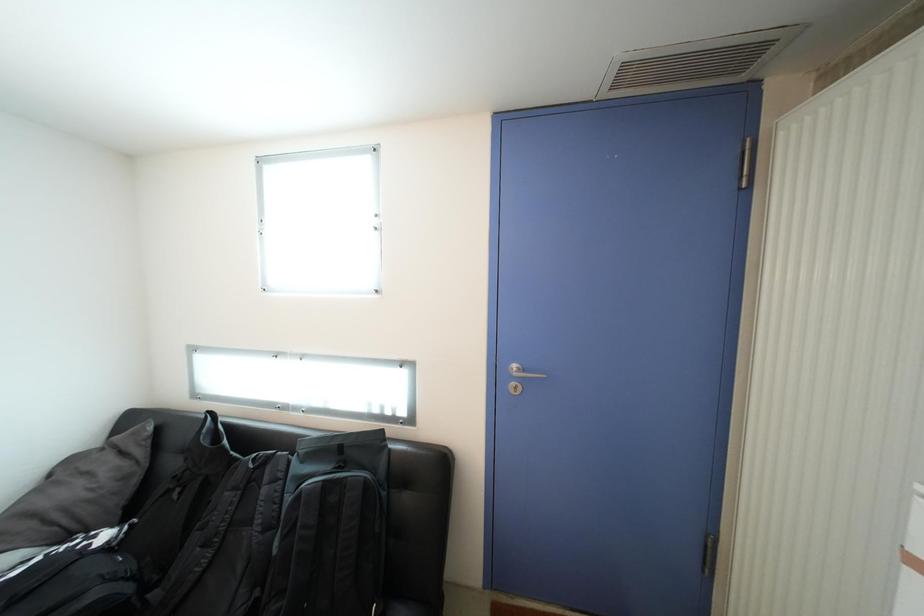
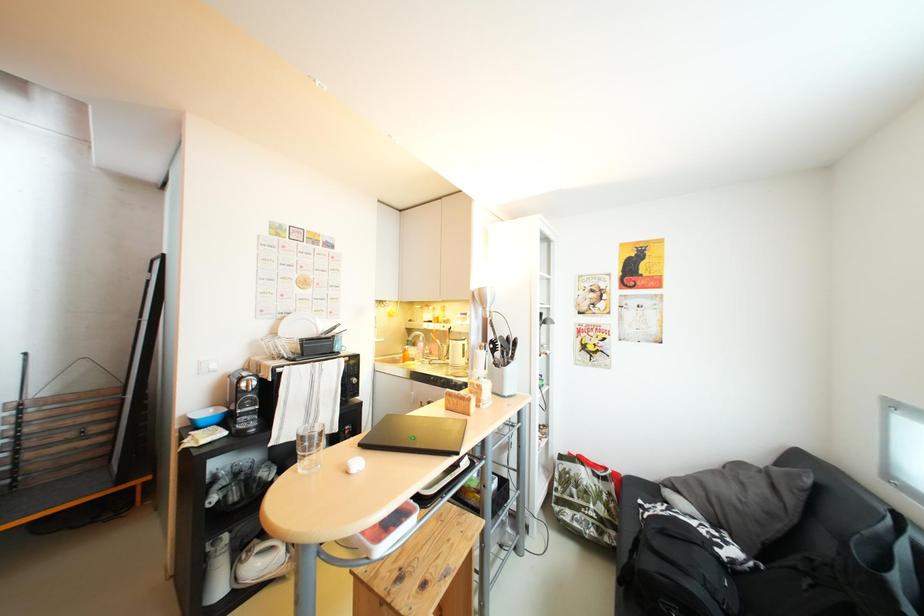
Question: How did the camera likely rotate?

Choices:
 (A) Left
 (B) Right
 (C) Up
 (D) Down

Answer: (A)